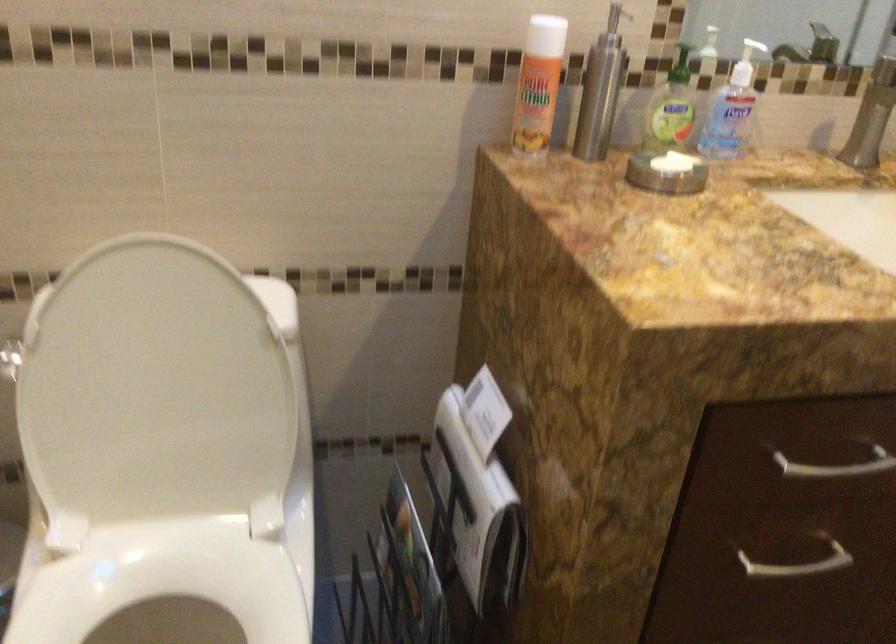
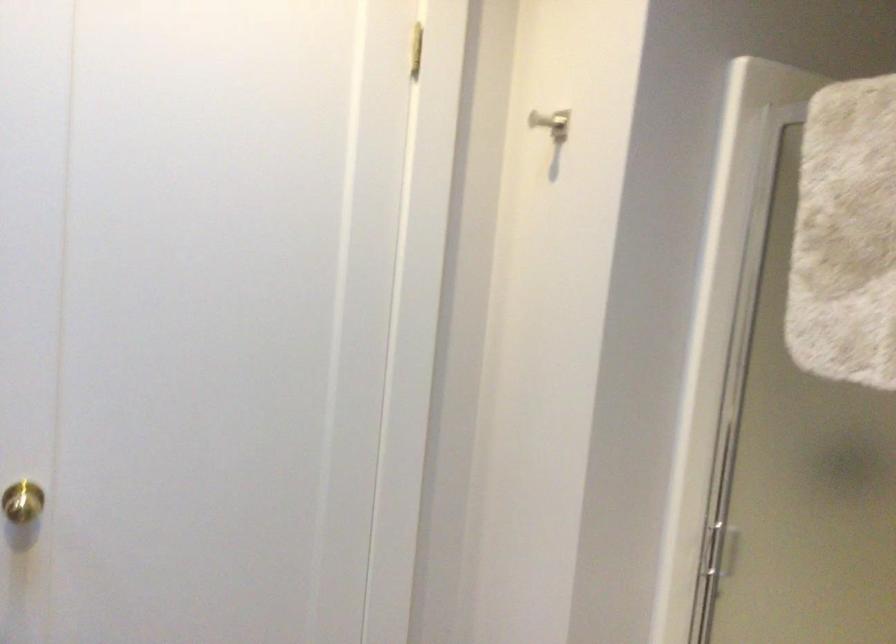
The first image is from the beginning of the video and the second image is from the end. How did the camera likely rotate when shooting the video?

The camera rotated toward right-down.